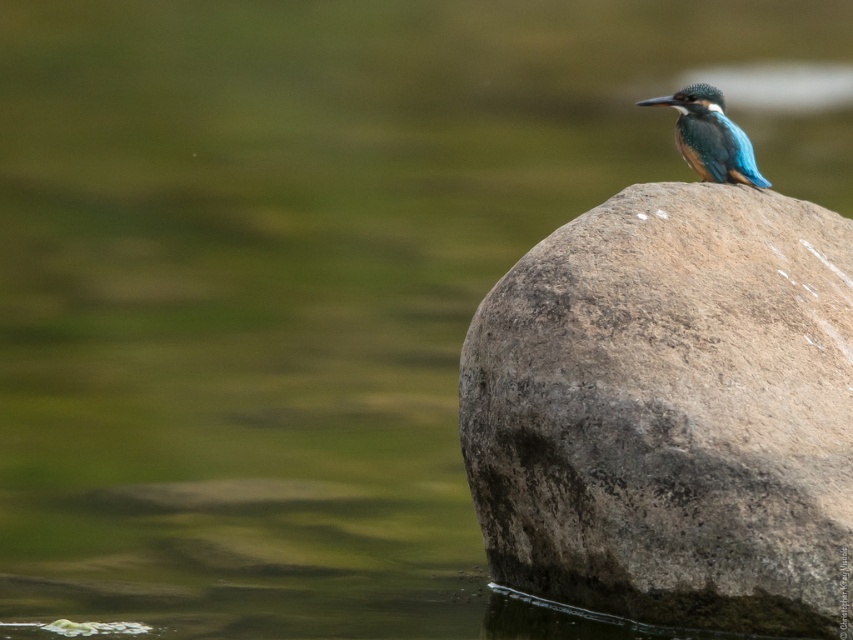
Question: Can you confirm if rough stone boulder at center is wider than blue glossy kingfisher at center?

Choices:
 (A) no
 (B) yes

Answer: (B)

Question: Which point appears closest to the camera in this image?

Choices:
 (A) (695, 113)
 (B) (808, 388)

Answer: (B)

Question: Does rough stone boulder at center come in front of blue glossy kingfisher at center?

Choices:
 (A) yes
 (B) no

Answer: (A)

Question: Which object is closer to the camera taking this photo?

Choices:
 (A) rough stone boulder at center
 (B) blue glossy kingfisher at center

Answer: (A)

Question: Which point is farther from the camera taking this photo?

Choices:
 (A) (688, 116)
 (B) (711, 257)

Answer: (A)

Question: Does rough stone boulder at center have a smaller size compared to blue glossy kingfisher at center?

Choices:
 (A) no
 (B) yes

Answer: (A)